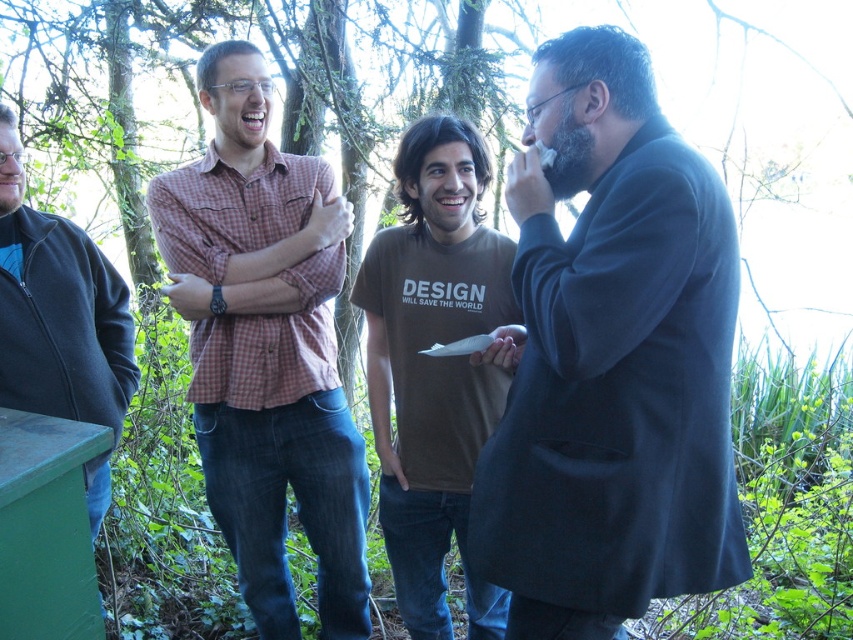
Can you confirm if dark blue suit at right is taller than dark blue fleece jacket at left?

Correct, dark blue suit at right is much taller as dark blue fleece jacket at left.

Is point (590, 499) positioned before point (16, 244)?

Yes, point (590, 499) is closer to viewer.

Locate an element on the screen. Image resolution: width=853 pixels, height=640 pixels. dark blue suit at right is located at coordinates (611, 360).

Between checkered fabric shirt at center and dark blue fleece jacket at left, which one appears on the left side from the viewer's perspective?

dark blue fleece jacket at left is more to the left.

Does checkered fabric shirt at center have a lesser width compared to dark blue fleece jacket at left?

No, checkered fabric shirt at center is not thinner than dark blue fleece jacket at left.

Which is in front, point (341, 566) or point (57, 337)?

Point (57, 337)

This screenshot has height=640, width=853. What are the coordinates of `checkered fabric shirt at center` in the screenshot? It's located at (265, 348).

Is point (738, 268) positioned before point (361, 529)?

Yes, point (738, 268) is closer to viewer.

Does dark blue suit at right have a lesser height compared to checkered fabric shirt at center?

Indeed, dark blue suit at right has a lesser height compared to checkered fabric shirt at center.

Which is behind, point (550, 337) or point (192, 269)?

Point (192, 269)

The width and height of the screenshot is (853, 640). Find the location of `dark blue suit at right`. dark blue suit at right is located at coordinates (611, 360).